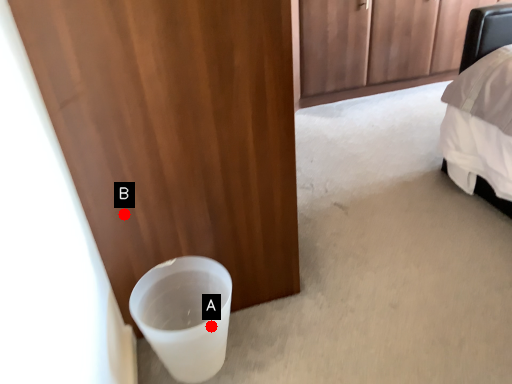
Question: Two points are circled on the image, labeled by A and B beside each circle. Which of the following is the farthest from the observer?

Choices:
 (A) A is further
 (B) B is further

Answer: (B)